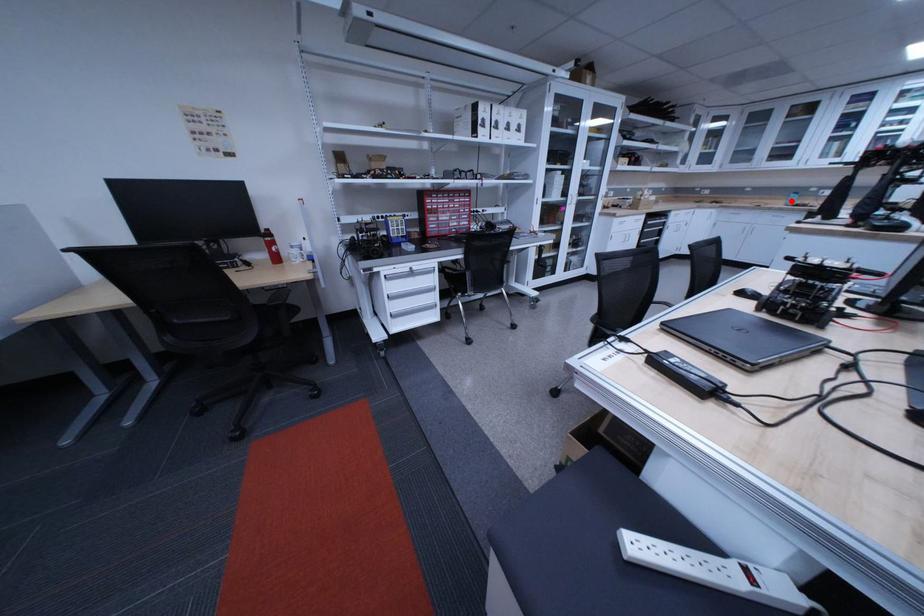
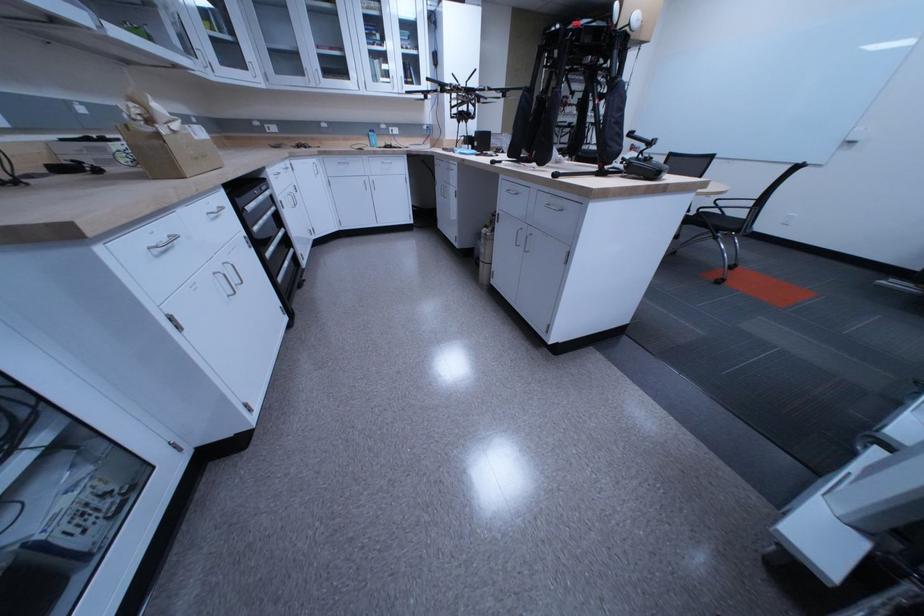
Question: I am providing you with two images of the same scene from different viewpoints. Image1 has a red point marked. In image2, the corresponding 3D location appears at what relative position? Reply with the corresponding letter.

Choices:
 (A) Closer
 (B) Farther

Answer: (A)